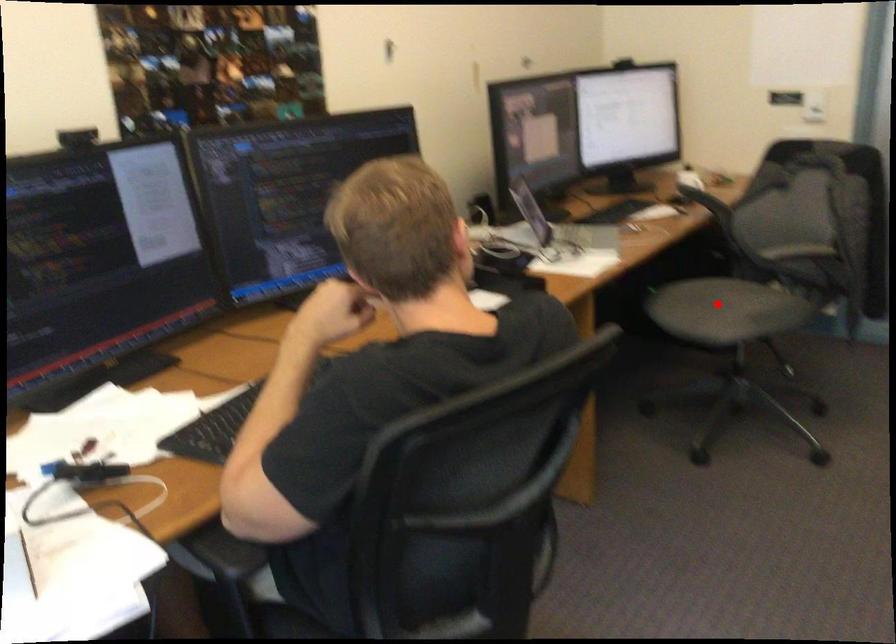
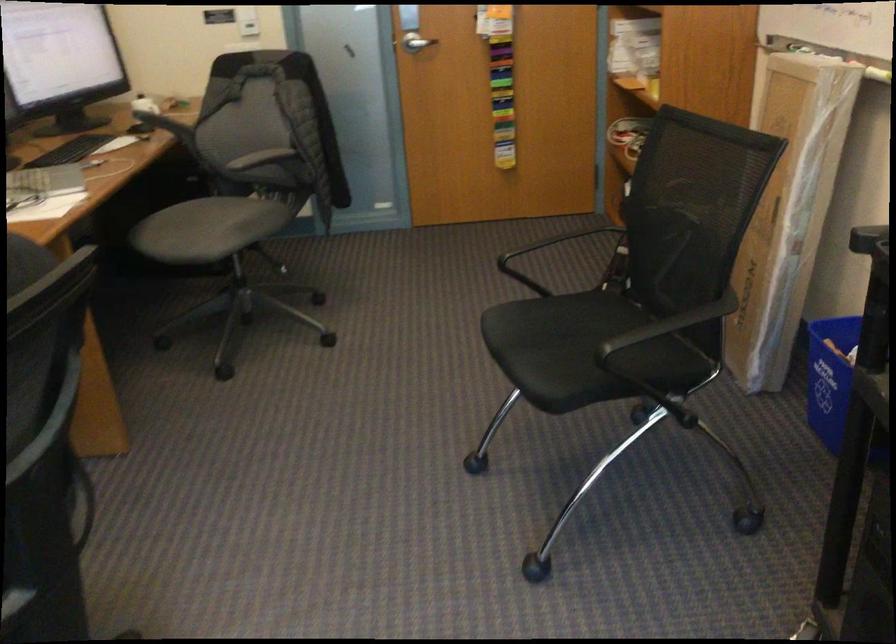
In the second image, find the point that corresponds to the highlighted location in the first image.

(207, 229)